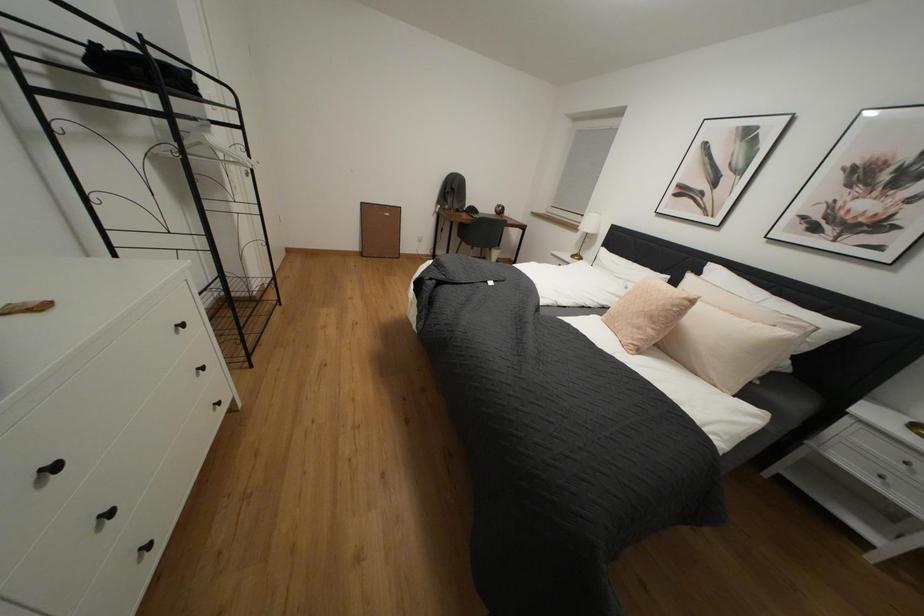
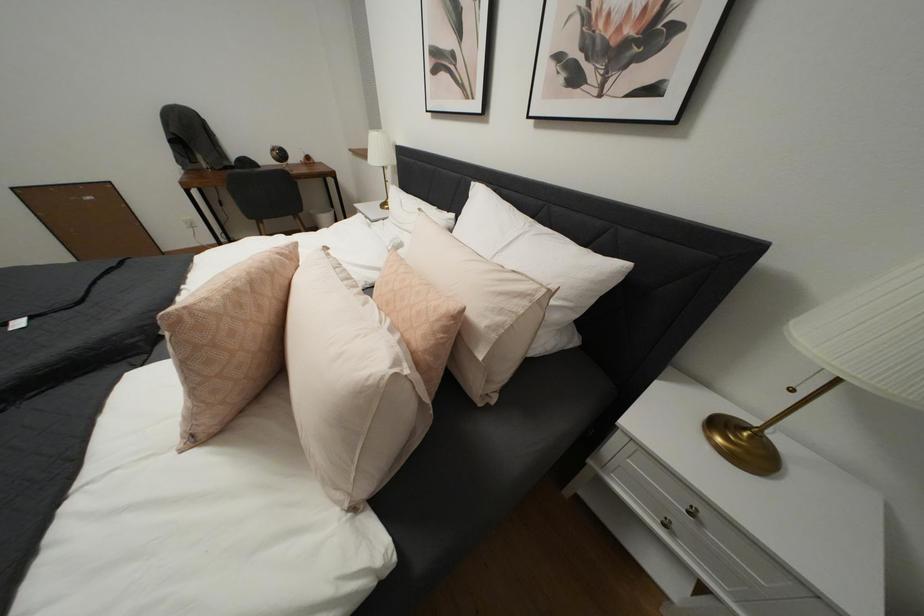
Which direction would the cameraman need to move to produce the second image?

The cameraman moved toward right, forward.